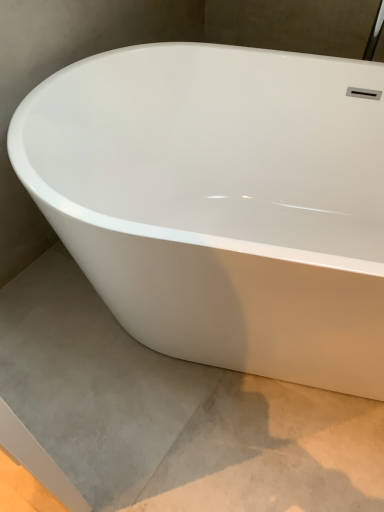
What is the approximate width of gray concrete at lower left?

The width of gray concrete at lower left is 78.09 centimeters.

Describe the element at coordinates (172, 413) in the screenshot. Image resolution: width=384 pixels, height=512 pixels. I see `gray concrete at lower left` at that location.

Image resolution: width=384 pixels, height=512 pixels. I want to click on gray concrete at lower left, so click(x=172, y=413).

Describe the element at coordinates (222, 203) in the screenshot. The image size is (384, 512). I see `white glossy bathtub at center` at that location.

At what (x,y) coordinates should I click in order to perform the action: click on white glossy bathtub at center. Please return your answer as a coordinate pair (x, y). Looking at the image, I should click on (222, 203).

This screenshot has width=384, height=512. I want to click on gray concrete at lower left, so click(172, 413).

In the scene shown: Which object is positioned more to the left, gray concrete at lower left or white glossy bathtub at center?

Positioned to the left is gray concrete at lower left.

Considering the positions of objects gray concrete at lower left and white glossy bathtub at center in the image provided, who is in front, gray concrete at lower left or white glossy bathtub at center?

white glossy bathtub at center is in front.

Is point (92, 300) positioned behind point (223, 202)?

No.

From the image's perspective, is gray concrete at lower left on white glossy bathtub at center?

No, from the image's perspective, gray concrete at lower left is not on top of white glossy bathtub at center.

From a real-world perspective, is gray concrete at lower left physically below white glossy bathtub at center?

Yes, from a real-world perspective, gray concrete at lower left is beneath white glossy bathtub at center.

Can you confirm if gray concrete at lower left is wider than white glossy bathtub at center?

No.

From their relative heights in the image, would you say gray concrete at lower left is taller or shorter than white glossy bathtub at center?

Considering their sizes, gray concrete at lower left has less height than white glossy bathtub at center.

Is gray concrete at lower left bigger than white glossy bathtub at center?

No.

Does gray concrete at lower left contain white glossy bathtub at center?

No, gray concrete at lower left does not contain white glossy bathtub at center.

In the scene shown: Is gray concrete at lower left positioned far away from white glossy bathtub at center?

No.

Is gray concrete at lower left oriented away from white glossy bathtub at center?

No, white glossy bathtub at center is not at the back of gray concrete at lower left.

How different are the orientations of gray concrete at lower left and white glossy bathtub at center in degrees?

The angle between the facing direction of gray concrete at lower left and the facing direction of white glossy bathtub at center is 159 degrees.

How distant is gray concrete at lower left from white glossy bathtub at center?

gray concrete at lower left is 15.44 inches away from white glossy bathtub at center.

Locate an element on the screen. concrete below the white glossy bathtub at center (from a real-world perspective) is located at coordinates (172, 413).

Which object is positioned more to the left, white glossy bathtub at center or gray concrete at lower left?

gray concrete at lower left.

Considering the relative positions of white glossy bathtub at center and gray concrete at lower left in the image provided, is white glossy bathtub at center behind gray concrete at lower left?

No, it is in front of gray concrete at lower left.

Consider the image. Which point is more forward, (101, 289) or (362, 424)?

Positioned in front is point (101, 289).

From the image's perspective, is white glossy bathtub at center beneath gray concrete at lower left?

No.

In the scene shown: From a real-world perspective, is white glossy bathtub at center on gray concrete at lower left?

Yes, from a real-world perspective, white glossy bathtub at center is on top of gray concrete at lower left.

Based on the photo, which of these two, white glossy bathtub at center or gray concrete at lower left, is wider?

Wider between the two is white glossy bathtub at center.

Considering the sizes of objects white glossy bathtub at center and gray concrete at lower left in the image provided, who is shorter, white glossy bathtub at center or gray concrete at lower left?

gray concrete at lower left is shorter.

From the picture: Which of these two, white glossy bathtub at center or gray concrete at lower left, is smaller?

gray concrete at lower left.

Based on the photo, would you say gray concrete at lower left is part of white glossy bathtub at center's contents?

Actually, gray concrete at lower left is outside white glossy bathtub at center.

Is white glossy bathtub at center not close to gray concrete at lower left?

No, white glossy bathtub at center is in close proximity to gray concrete at lower left.

Is white glossy bathtub at center positioned with its back to gray concrete at lower left?

No, white glossy bathtub at center's orientation is not away from gray concrete at lower left.

Measure the distance between white glossy bathtub at center and gray concrete at lower left.

A distance of 15.44 inches exists between white glossy bathtub at center and gray concrete at lower left.

I want to click on concrete that is below the white glossy bathtub at center (from the image's perspective), so click(x=172, y=413).

Locate an element on the screen. concrete below the white glossy bathtub at center (from the image's perspective) is located at coordinates (172, 413).

Where is `bathtub that is above the gray concrete at lower left (from the image's perspective)`? The image size is (384, 512). bathtub that is above the gray concrete at lower left (from the image's perspective) is located at coordinates pyautogui.click(x=222, y=203).